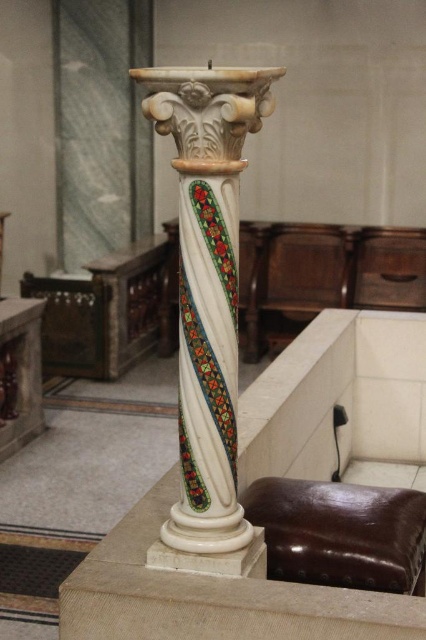
You are standing in the room and want to place a decorative vase on the floor directly in front of the white marble column at center. According to the image, where should you position the vase relative to the column?

The white marble column at center is located at point (207, 308), so you should place the vase directly in front of it at the same coordinates.

Based on the photo, you are a visitor in a museum and want to sit on the brown leather stool at lower center. Can you sit there without touching the white marble column at center?

The white marble column at center is located above the brown leather stool at lower center, so sitting on the stool would not cause contact with the column since they are vertically aligned but separated by space.